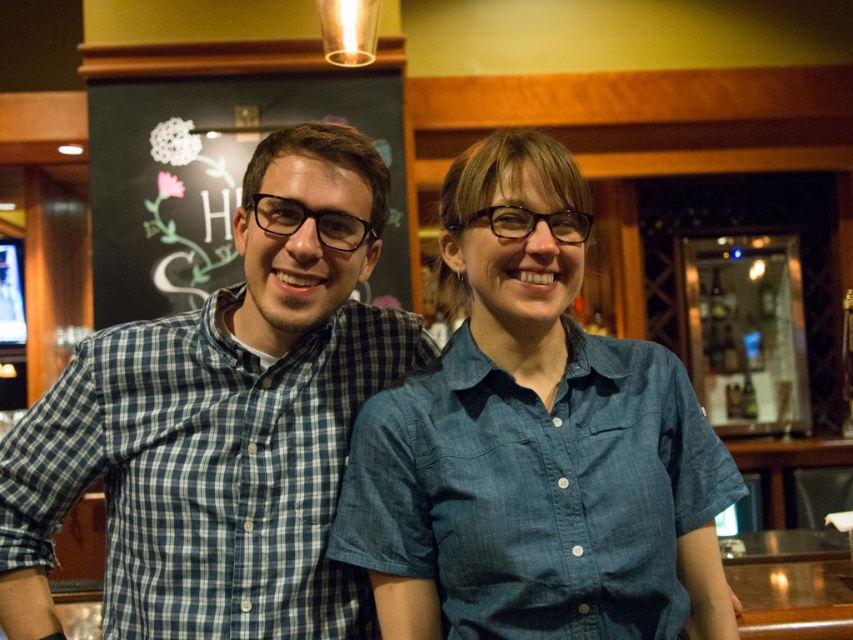
Which of these two, denim shirt at center or blue checkered shirt at left, stands shorter?

denim shirt at center is shorter.

Does denim shirt at center have a smaller size compared to blue checkered shirt at left?

Incorrect, denim shirt at center is not smaller in size than blue checkered shirt at left.

Where is `denim shirt at center`? denim shirt at center is located at coordinates (535, 444).

Where is `denim shirt at center`? denim shirt at center is located at coordinates (535, 444).

Based on the photo, which of these two, blue checkered shirt at left or black chalkboard at upper left, stands taller?

black chalkboard at upper left is taller.

Between blue checkered shirt at left and black chalkboard at upper left, which one appears on the right side from the viewer's perspective?

blue checkered shirt at left is more to the right.

Describe the element at coordinates (223, 422) in the screenshot. The height and width of the screenshot is (640, 853). I see `blue checkered shirt at left` at that location.

You are a GUI agent. You are given a task and a screenshot of the screen. Output one action in this format:
    pyautogui.click(x=<x>, y=<y>)
    Task: Click on the blue checkered shirt at left
    
    Given the screenshot: What is the action you would take?
    pyautogui.click(x=223, y=422)

Which is more to the left, denim shirt at center or black chalkboard at upper left?

Positioned to the left is black chalkboard at upper left.

Is point (412, 444) closer to camera compared to point (93, 156)?

Yes, point (412, 444) is closer to viewer.

Who is more distant from viewer, (703, 611) or (404, 296)?

The point (404, 296) is more distant.

Locate an element on the screen. denim shirt at center is located at coordinates (535, 444).